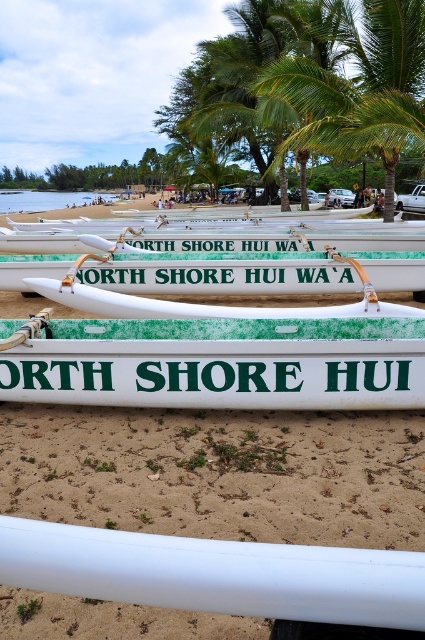
Question: Does white plastic canoe at center have a lesser width compared to white matte surfboard at center?

Choices:
 (A) yes
 (B) no

Answer: (B)

Question: Which point is closer to the camera taking this photo?

Choices:
 (A) (261, 534)
 (B) (359, 256)

Answer: (A)

Question: Which point is farther to the camera?

Choices:
 (A) green leafy palm tree at center
 (B) white matte surfboard at center
 (C) white glossy canoe at center
 (D) white plastic canoe at center

Answer: (A)

Question: Can you confirm if white plastic canoe at center is positioned to the left of white glossy canoe at center?

Choices:
 (A) yes
 (B) no

Answer: (A)

Question: Is green leafy palm tree at center bigger than white glossy canoe at center?

Choices:
 (A) no
 (B) yes

Answer: (A)

Question: Based on their relative distances, which object is farther from the white plastic canoe at center?

Choices:
 (A) white matte surfboard at center
 (B) white glossy canoe at center

Answer: (B)